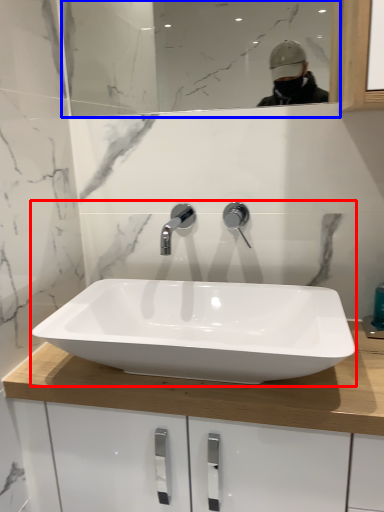
Question: Which of the following is the closest to the observer, sink (highlighted by a red box) or mirror (highlighted by a blue box)?

Choices:
 (A) sink
 (B) mirror

Answer: (A)